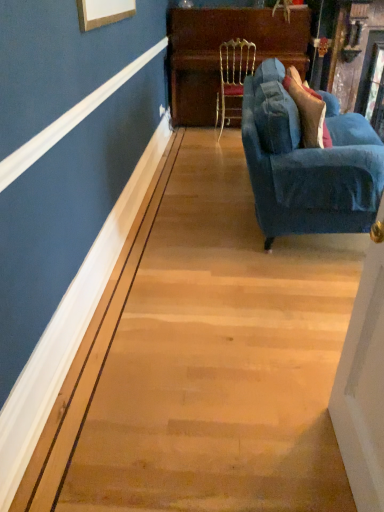
Question: From the image's perspective, does gold textured chair at center appear higher than velvet blue couch at right?

Choices:
 (A) no
 (B) yes

Answer: (B)

Question: From a real-world perspective, does gold textured chair at center stand above velvet blue couch at right?

Choices:
 (A) yes
 (B) no

Answer: (A)

Question: Could velvet blue couch at right be considered to be inside gold textured chair at center?

Choices:
 (A) no
 (B) yes

Answer: (A)

Question: Is gold textured chair at center at the left side of velvet blue couch at right?

Choices:
 (A) no
 (B) yes

Answer: (B)

Question: Does gold textured chair at center come behind velvet blue couch at right?

Choices:
 (A) yes
 (B) no

Answer: (A)

Question: Considering the relative sizes of gold textured chair at center and velvet blue couch at right in the image provided, is gold textured chair at center thinner than velvet blue couch at right?

Choices:
 (A) yes
 (B) no

Answer: (A)

Question: Considering the relative sizes of velvet blue couch at right and gold textured chair at center in the image provided, is velvet blue couch at right thinner than gold textured chair at center?

Choices:
 (A) no
 (B) yes

Answer: (A)

Question: Can you confirm if velvet blue couch at right is taller than gold textured chair at center?

Choices:
 (A) no
 (B) yes

Answer: (A)

Question: From a real-world perspective, is velvet blue couch at right below gold textured chair at center?

Choices:
 (A) yes
 (B) no

Answer: (A)

Question: Is gold textured chair at center a part of velvet blue couch at right?

Choices:
 (A) yes
 (B) no

Answer: (B)

Question: Are velvet blue couch at right and gold textured chair at center far apart?

Choices:
 (A) yes
 (B) no

Answer: (A)

Question: Is velvet blue couch at right not inside gold textured chair at center?

Choices:
 (A) no
 (B) yes

Answer: (B)

Question: Is the position of gold textured chair at center more distant than that of wooden polished dresser at upper center?

Choices:
 (A) no
 (B) yes

Answer: (A)